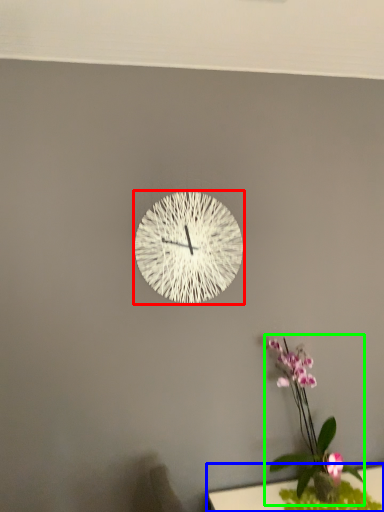
Question: Based on their relative distances, which object is farther from wall clock (highlighted by a red box)? Choose from table (highlighted by a blue box) and floral arrangement (highlighted by a green box).

Choices:
 (A) table
 (B) floral arrangement

Answer: (A)